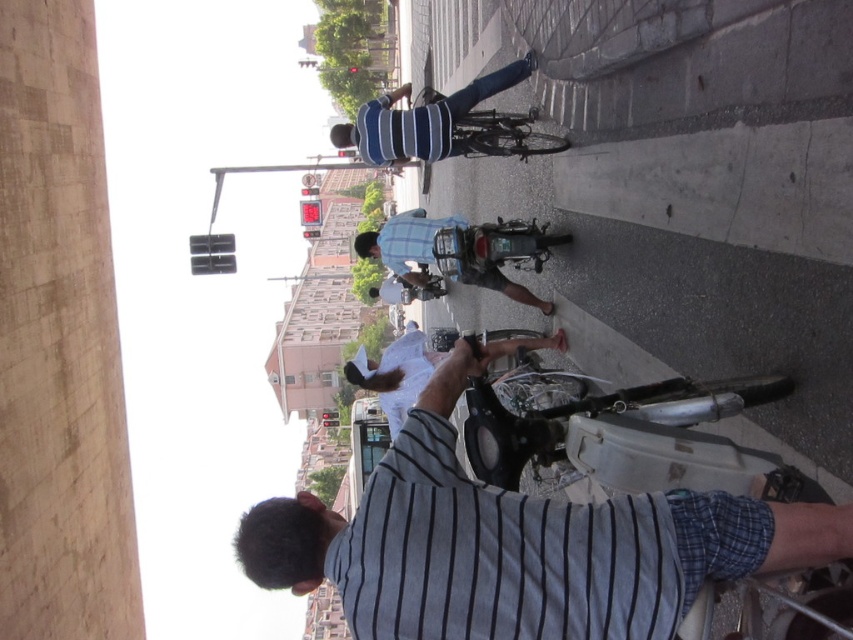
Which of these two, gray striped shirt at center or blue plaid shirt at center, stands shorter?

Standing shorter between the two is blue plaid shirt at center.

Which is above, gray striped shirt at center or blue plaid shirt at center?

blue plaid shirt at center is higher up.

Measure the distance between point (500, 506) and camera.

They are 32.93 meters apart.

The width and height of the screenshot is (853, 640). I want to click on gray striped shirt at center, so click(x=518, y=545).

Does striped fabric shirt at center appear over blue plaid shirt at center?

Correct, striped fabric shirt at center is located above blue plaid shirt at center.

The height and width of the screenshot is (640, 853). I want to click on striped fabric shirt at center, so click(x=421, y=120).

Locate an element on the screen. This screenshot has width=853, height=640. striped fabric shirt at center is located at coordinates (421, 120).

The width and height of the screenshot is (853, 640). Find the location of `striped fabric shirt at center`. striped fabric shirt at center is located at coordinates (421, 120).

Does white fabric shirt at center have a greater height compared to blue plaid shirt at center?

Indeed, white fabric shirt at center has a greater height compared to blue plaid shirt at center.

From the picture: Does white fabric shirt at center appear on the right side of blue plaid shirt at center?

Incorrect, white fabric shirt at center is not on the right side of blue plaid shirt at center.

You are a GUI agent. You are given a task and a screenshot of the screen. Output one action in this format:
    pyautogui.click(x=<x>, y=<y>)
    Task: Click on the white fabric shirt at center
    This screenshot has height=640, width=853.
    Given the screenshot: What is the action you would take?
    pyautogui.click(x=396, y=372)

You are a GUI agent. You are given a task and a screenshot of the screen. Output one action in this format:
    pyautogui.click(x=<x>, y=<y>)
    Task: Click on the white fabric shirt at center
    The width and height of the screenshot is (853, 640).
    Given the screenshot: What is the action you would take?
    pyautogui.click(x=396, y=372)